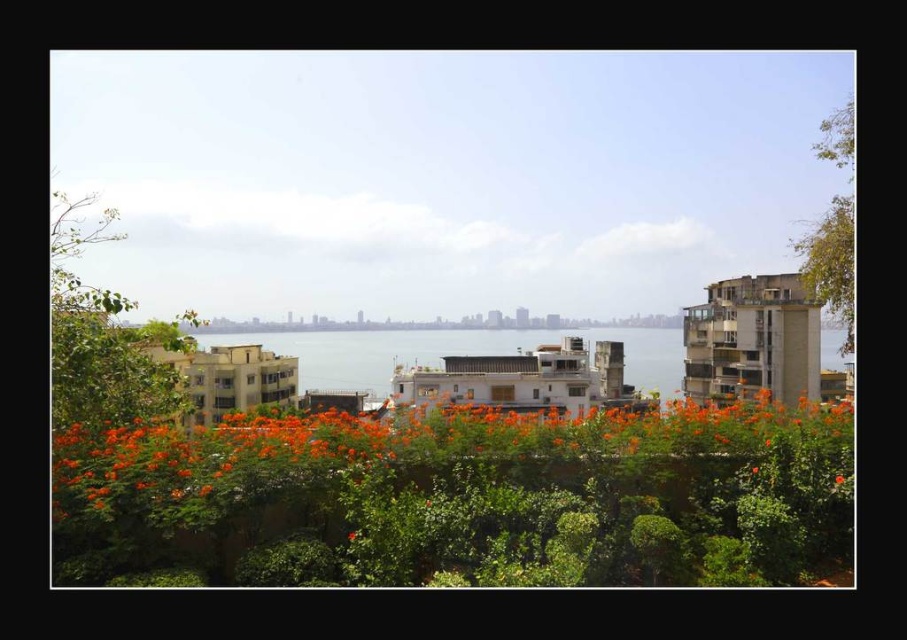
Which is above, green leafy tree at left or orange matte flower at center?

green leafy tree at left

Is green leafy tree at left positioned at the back of orange matte flower at center?

Yes, green leafy tree at left is behind orange matte flower at center.

Does point (109, 208) come behind point (837, 477)?

Yes, point (109, 208) is farther from viewer.

The width and height of the screenshot is (907, 640). What are the coordinates of `green leafy tree at left` in the screenshot? It's located at (104, 336).

Between green leafy tree at left and green leafy tree at upper right, which one appears on the right side from the viewer's perspective?

green leafy tree at upper right is more to the right.

Does green leafy tree at left appear over green leafy tree at upper right?

Incorrect, green leafy tree at left is not positioned above green leafy tree at upper right.

Find the location of `green leafy tree at left`. green leafy tree at left is located at coordinates (104, 336).

Image resolution: width=907 pixels, height=640 pixels. What do you see at coordinates (442, 454) in the screenshot?
I see `orange matte flowers at center` at bounding box center [442, 454].

Who is positioned more to the left, orange matte flowers at center or green leafy tree at left?

green leafy tree at left is more to the left.

Which is in front, point (216, 454) or point (77, 291)?

Point (216, 454) is more forward.

Where is `orange matte flowers at center`? The width and height of the screenshot is (907, 640). orange matte flowers at center is located at coordinates (442, 454).